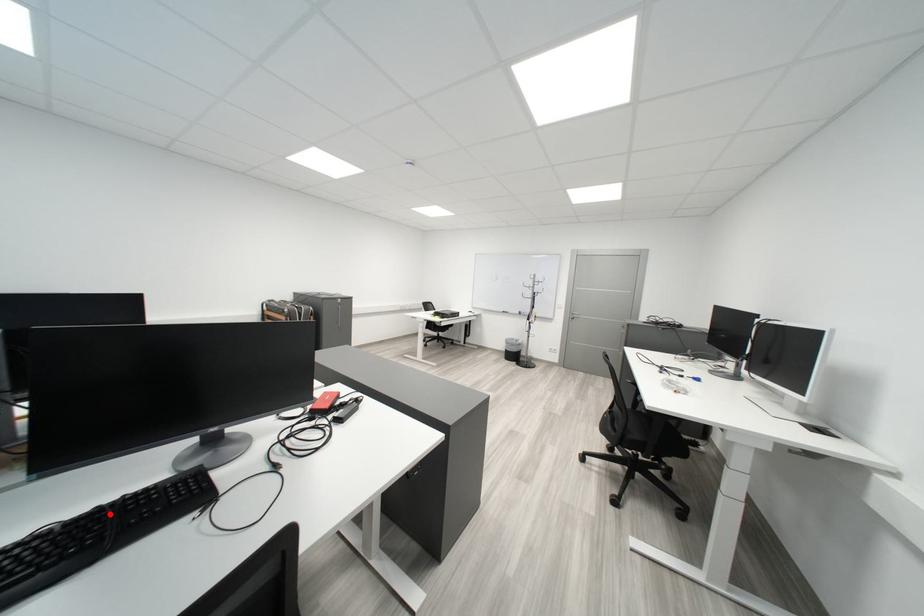
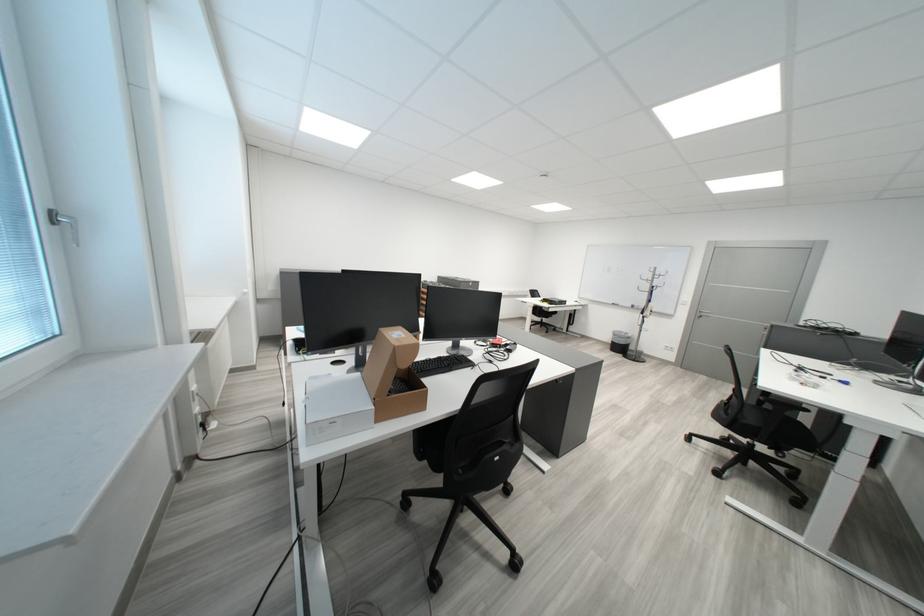
Question: I am providing you with two images of the same scene from different viewpoints. A red point is marked on the first image. At the location where the point appears in image 1, is it still visible in image 2?

Choices:
 (A) Yes
 (B) No

Answer: (A)